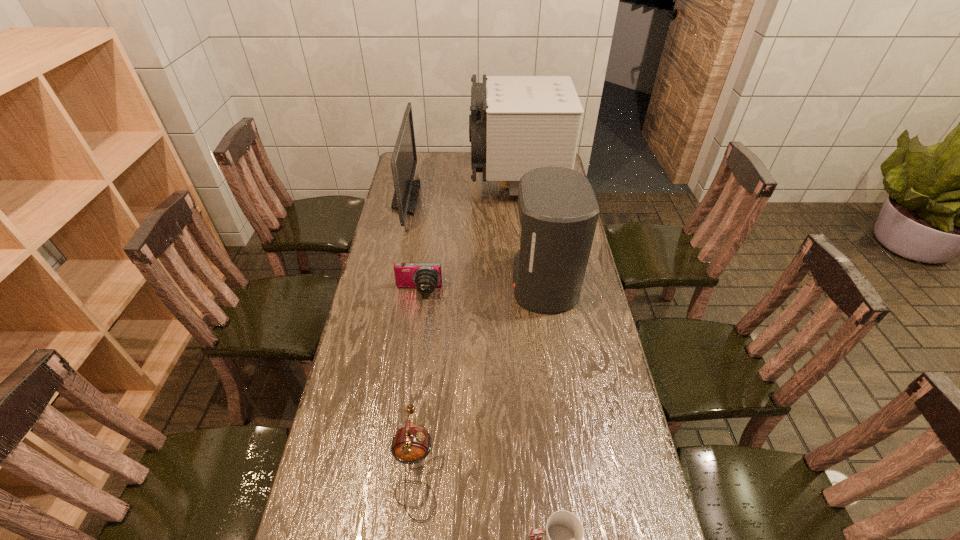
Where is `free space between the monitor and the telephone`? This screenshot has height=540, width=960. free space between the monitor and the telephone is located at coordinates (411, 333).

Locate an element on the screen. object that stands as the closest to the monitor is located at coordinates [517, 123].

Identify which object is located as the nearest to the cup. Please provide its 2D coordinates. Your answer should be formatted as a tuple, i.e. [(x, y)], where the tuple contains the x and y coordinates of a point satisfying the conditions above.

[(411, 444)]

Find the location of a particular element. This screenshot has width=960, height=540. vacant point that satisfies the following two spatial constraints: 1. on the button side of the coffee maker; 2. on the front-facing side of the camera is located at coordinates (544, 292).

Locate an element on the screen. The height and width of the screenshot is (540, 960). free space that satisfies the following two spatial constraints: 1. on the button side of the coffee maker; 2. on the front-facing side of the camera is located at coordinates (544, 292).